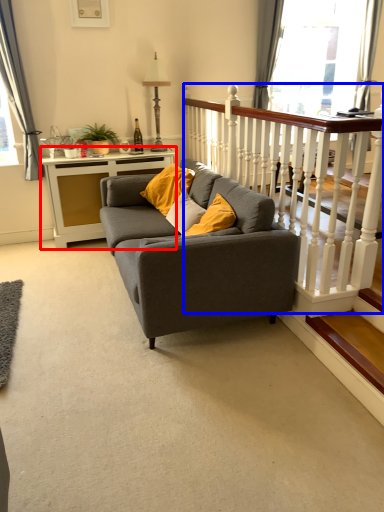
Question: Which point is further to the camera, table (highlighted by a red box) or balustrade (highlighted by a blue box)?

Choices:
 (A) table
 (B) balustrade

Answer: (A)